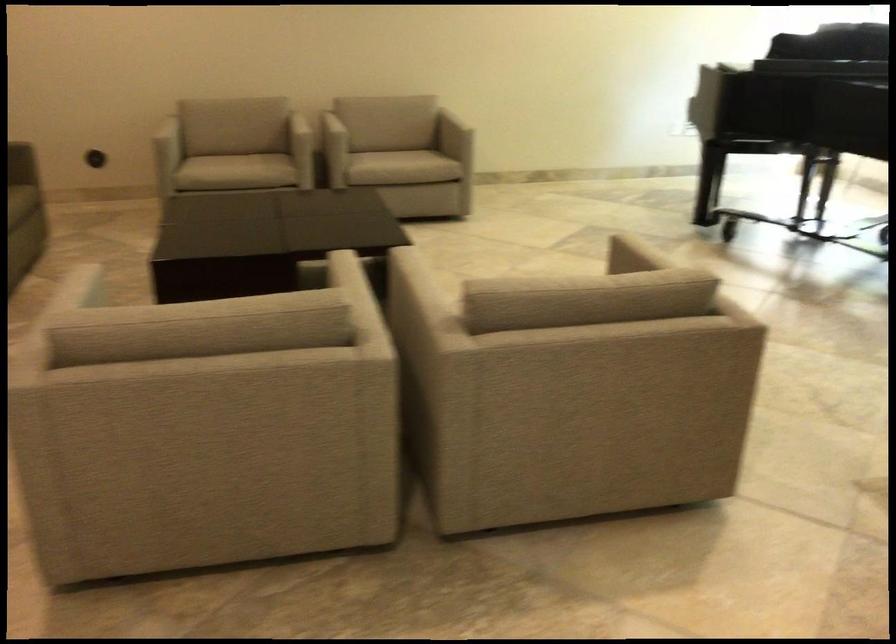
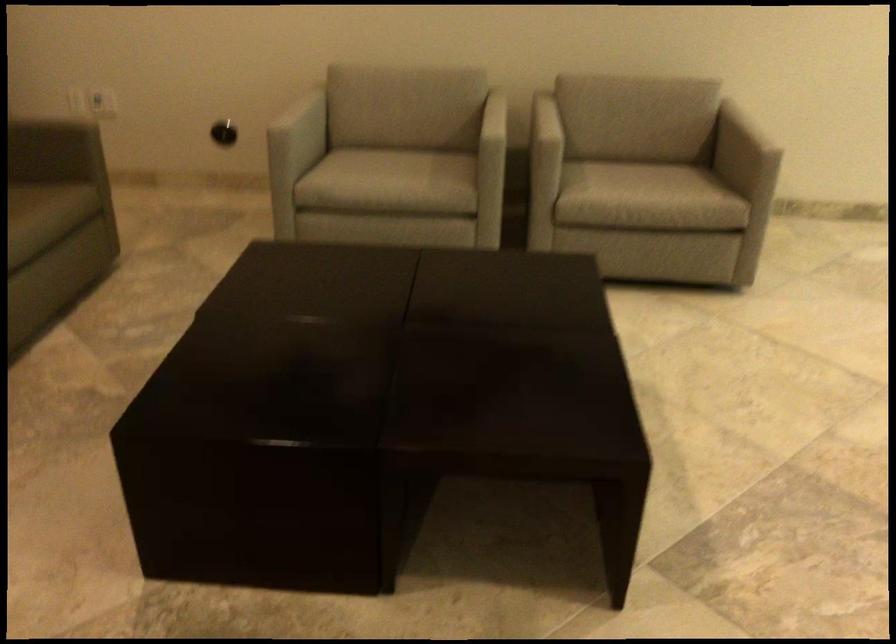
Locate, in the second image, the point that corresponds to point (304, 138) in the first image.

(492, 151)